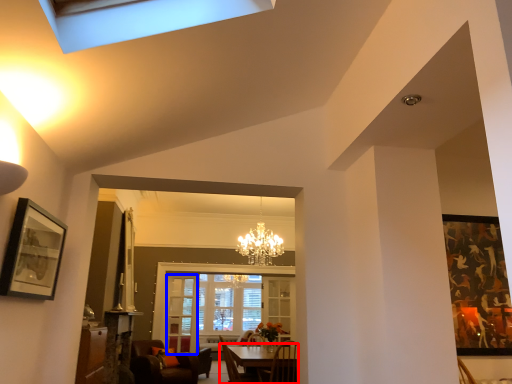
Question: Which object is further to the camera taking this photo, table (highlighted by a red box) or glass door (highlighted by a blue box)?

Choices:
 (A) table
 (B) glass door

Answer: (B)